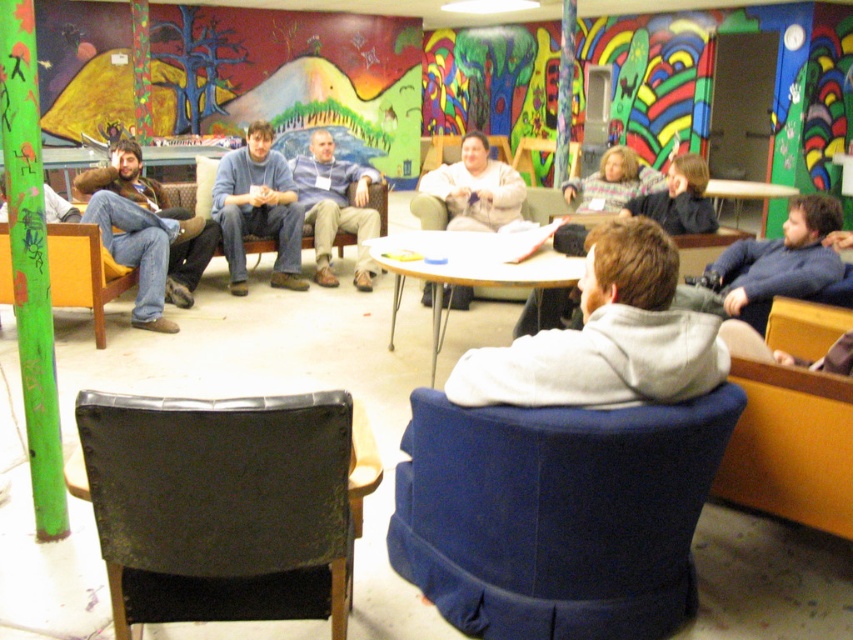
You are standing in the lounge and want to sit in the blue fabric swivel chair at center. Based on the coordinates provided, which object in the scene is located at point (x=556, y=513)?

The point (x=556, y=513) corresponds to the blue fabric swivel chair at center.

You are organizing a clothing donation drive and need to determine which item takes up more space. Based on the scene, which item between the jeans at left and the white fleece sweater at center is bigger in size?

The jeans at left is larger in size than the white fleece sweater at center, so the jeans at left takes up more space.